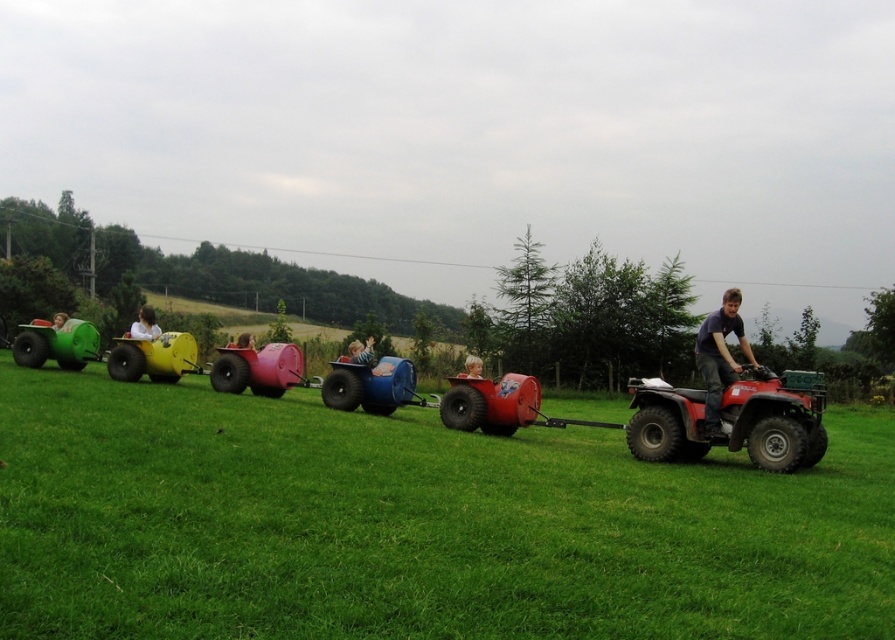
In the scene shown: You are a safety inspector checking the safety gear in the image. You noticed a point at coordinate [243,340]. What safety item is located there?

The smooth pink helmet at center is located at point [243,340].

Where is the smooth pink helmet at center located in the image?

The smooth pink helmet at center is located at the 2D coordinate point of (243, 340) in the image.